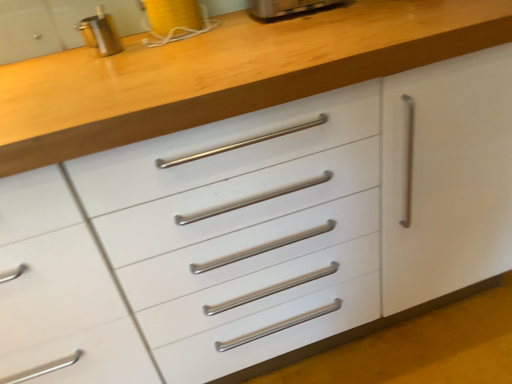
Image resolution: width=512 pixels, height=384 pixels. Find the location of `vacant space to the right of metallic silver canister at upper left`. vacant space to the right of metallic silver canister at upper left is located at coordinates (163, 42).